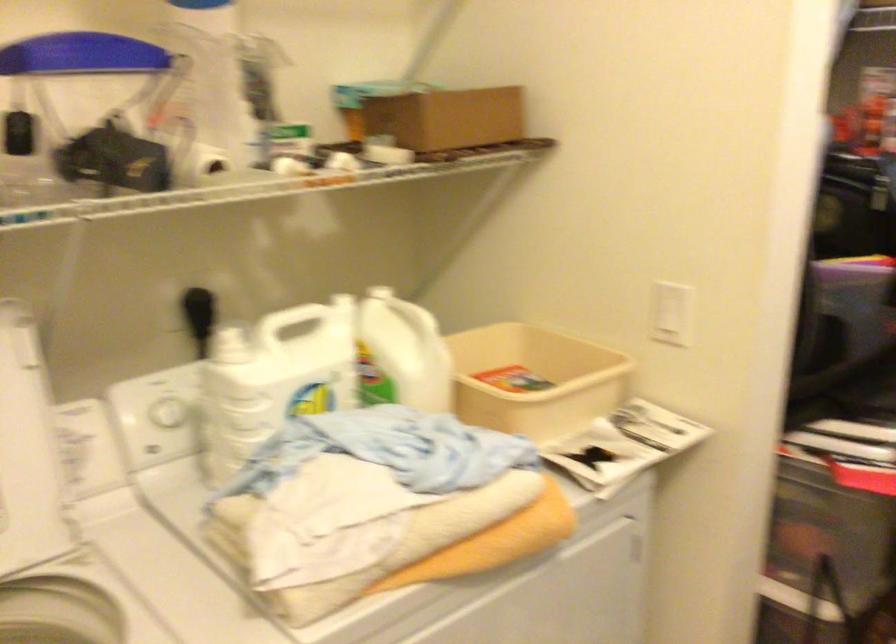
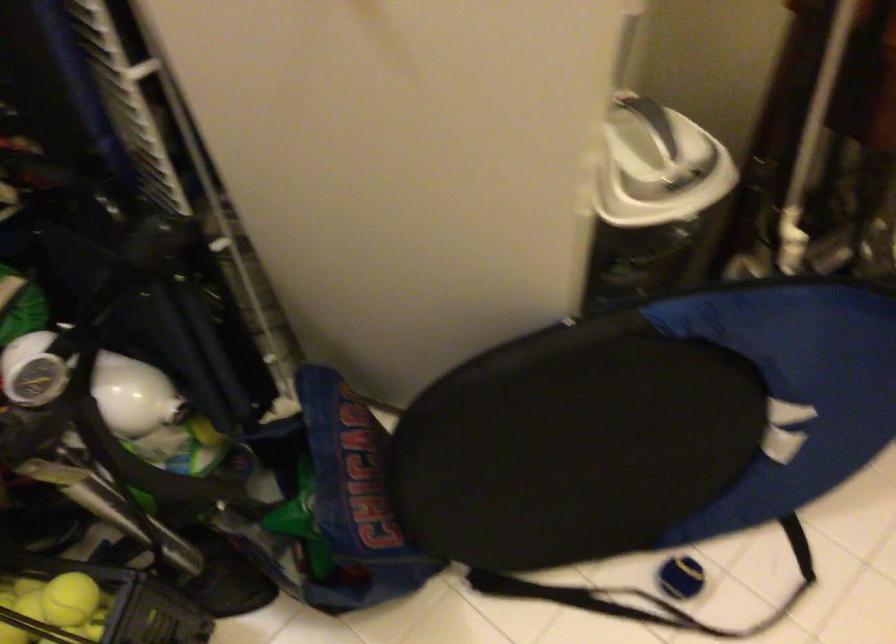
How did the camera likely rotate?

The rotation direction of the camera is right-down.